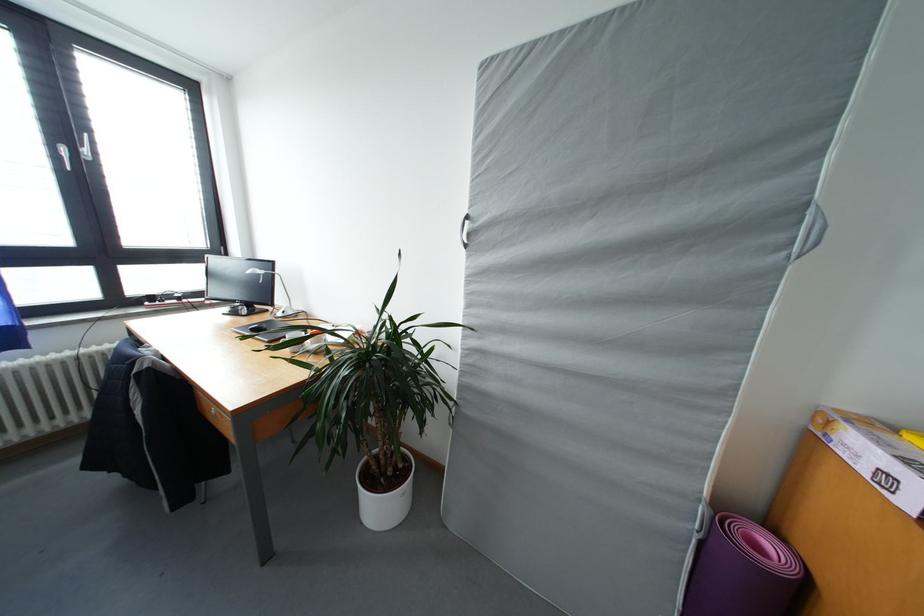
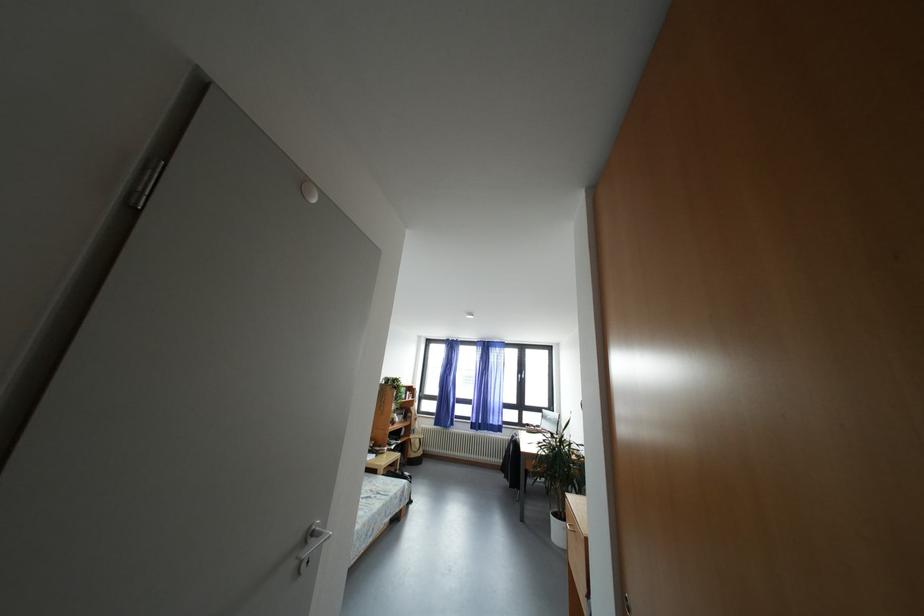
Locate, in the second image, the point that corresponds to (157,302) in the first image.

(533, 430)